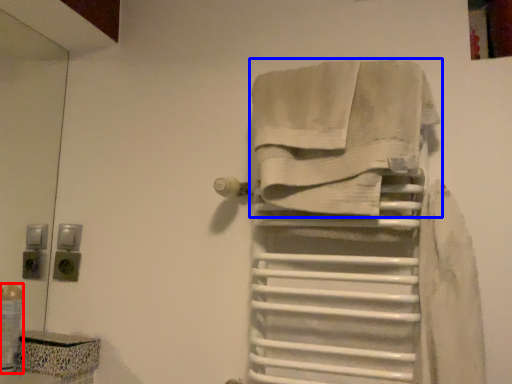
Question: Which point is further to the camera, toiletry (highlighted by a red box) or towel (highlighted by a blue box)?

Choices:
 (A) toiletry
 (B) towel

Answer: (A)